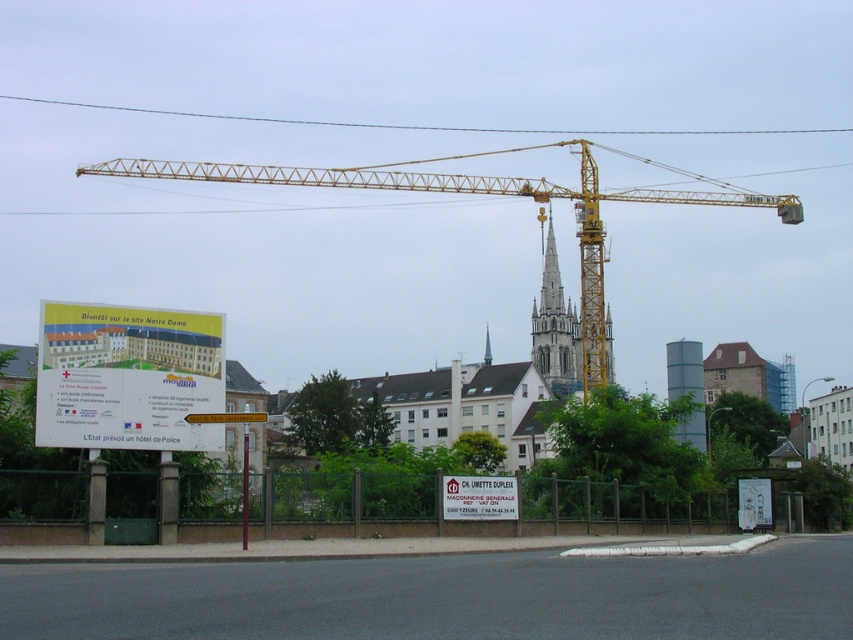
You are a surveyor analyzing the construction site. You have two points marked on your map at coordinates point (258,413) and point (486,349). Which point is closer to your current position?

Point (258,413) is closer to the camera than point (486,349), so it is closer to your current position.